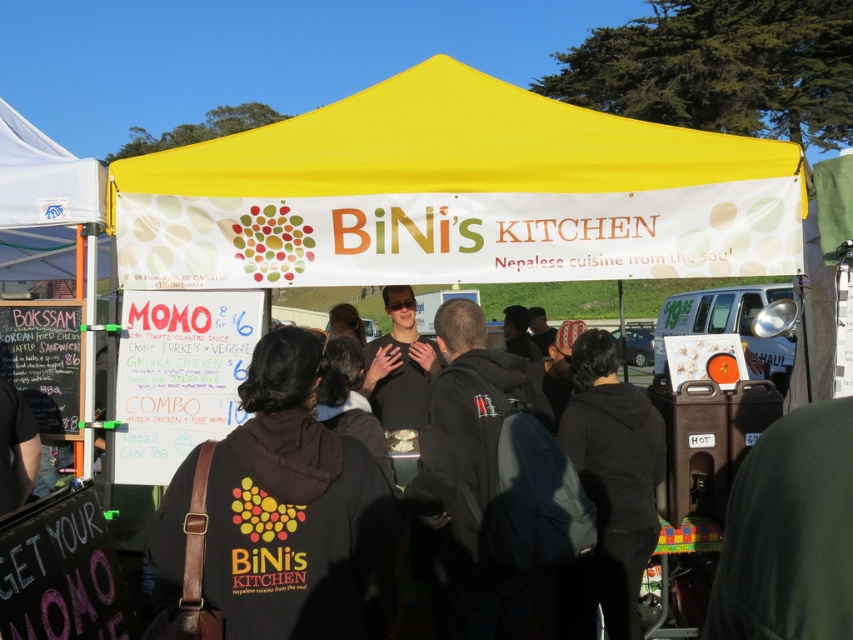
You are standing at the food stall under the bright yellow canopy labeled BiNi Kitchen. You want to reach a point that is exactly 2.37 meters away from you. Can you confirm if the point at coordinates point (300,636) is the correct location?

The point at coordinates point (300,636) is exactly 2.37 meters away from the viewer, so yes, it is the correct location.